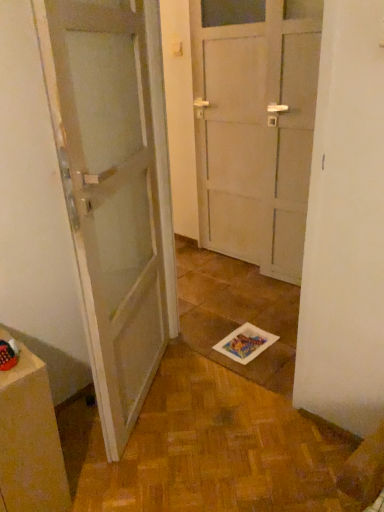
Image resolution: width=384 pixels, height=512 pixels. I want to click on matte brown cabinet at lower left, so click(x=30, y=441).

The width and height of the screenshot is (384, 512). What do you see at coordinates (30, 441) in the screenshot?
I see `matte brown cabinet at lower left` at bounding box center [30, 441].

Identify the location of white glossy door at left. This screenshot has height=512, width=384. (115, 191).

Describe the element at coordinates (115, 191) in the screenshot. I see `white glossy door at left` at that location.

Find the location of a particular element. Image resolution: width=384 pixels, height=512 pixels. matte brown cabinet at lower left is located at coordinates (30, 441).

Is matte brown cabinet at lower left at the left side of white glossy door at left?

Indeed, matte brown cabinet at lower left is positioned on the left side of white glossy door at left.

Which object is more forward, matte brown cabinet at lower left or white glossy door at left?

white glossy door at left is in front.

Is point (8, 372) closer or farther from the camera than point (156, 29)?

Clearly, point (8, 372) is closer to the camera than point (156, 29).

From the image's perspective, which one is positioned higher, matte brown cabinet at lower left or white glossy door at left?

white glossy door at left.

From a real-world perspective, is matte brown cabinet at lower left above or below white glossy door at left?

matte brown cabinet at lower left is below white glossy door at left.

Looking at their sizes, would you say matte brown cabinet at lower left is wider or thinner than white glossy door at left?

In the image, matte brown cabinet at lower left appears to be wider than white glossy door at left.

Looking at this image, is matte brown cabinet at lower left taller than white glossy door at left?

In fact, matte brown cabinet at lower left may be shorter than white glossy door at left.

Does matte brown cabinet at lower left have a smaller size compared to white glossy door at left?

Correct, matte brown cabinet at lower left occupies less space than white glossy door at left.

Is matte brown cabinet at lower left not within white glossy door at left?

Yes.

Is there a large distance between matte brown cabinet at lower left and white glossy door at left?

Actually, matte brown cabinet at lower left and white glossy door at left are a little close together.

Is matte brown cabinet at lower left oriented towards white glossy door at left?

No, matte brown cabinet at lower left is not turned towards white glossy door at left.

Can you tell me how much matte brown cabinet at lower left and white glossy door at left differ in facing direction?

matte brown cabinet at lower left and white glossy door at left are facing 32.2 degrees away from each other.

How much distance is there between matte brown cabinet at lower left and white glossy door at left?

They are 17.73 inches apart.

I want to click on cabinetry to the left of white glossy door at left, so click(x=30, y=441).

Is white glossy door at left at the right side of matte brown cabinet at lower left?

Correct, you'll find white glossy door at left to the right of matte brown cabinet at lower left.

From the picture: Does white glossy door at left come behind matte brown cabinet at lower left?

No, it is in front of matte brown cabinet at lower left.

Which is behind, point (153, 161) or point (31, 439)?

The point (153, 161) is farther from the camera.

From the image's perspective, relative to matte brown cabinet at lower left, is white glossy door at left above or below?

Based on their image positions, white glossy door at left is located above matte brown cabinet at lower left.

From a real-world perspective, who is located higher, white glossy door at left or matte brown cabinet at lower left?

white glossy door at left is physically above.

Between white glossy door at left and matte brown cabinet at lower left, which one has smaller width?

white glossy door at left.

Considering the sizes of white glossy door at left and matte brown cabinet at lower left in the image, is white glossy door at left taller or shorter than matte brown cabinet at lower left?

Clearly, white glossy door at left is taller compared to matte brown cabinet at lower left.

Based on the photo, based on their sizes in the image, would you say white glossy door at left is bigger or smaller than matte brown cabinet at lower left?

In the image, white glossy door at left appears to be larger than matte brown cabinet at lower left.

Would you say white glossy door at left contains matte brown cabinet at lower left?

That's incorrect, matte brown cabinet at lower left is not inside white glossy door at left.

Would you consider white glossy door at left to be distant from matte brown cabinet at lower left?

No, there isn't a large distance between white glossy door at left and matte brown cabinet at lower left.

Is white glossy door at left turned away from matte brown cabinet at lower left?

That's not correct — white glossy door at left is not looking away from matte brown cabinet at lower left.

Measure the distance between white glossy door at left and matte brown cabinet at lower left.

white glossy door at left is 17.73 inches away from matte brown cabinet at lower left.

Identify the location of door above the matte brown cabinet at lower left (from a real-world perspective). (115, 191).

Find the location of a particular element. cabinetry on the left side of white glossy door at left is located at coordinates (x=30, y=441).

Identify the location of door on the right of matte brown cabinet at lower left. (115, 191).